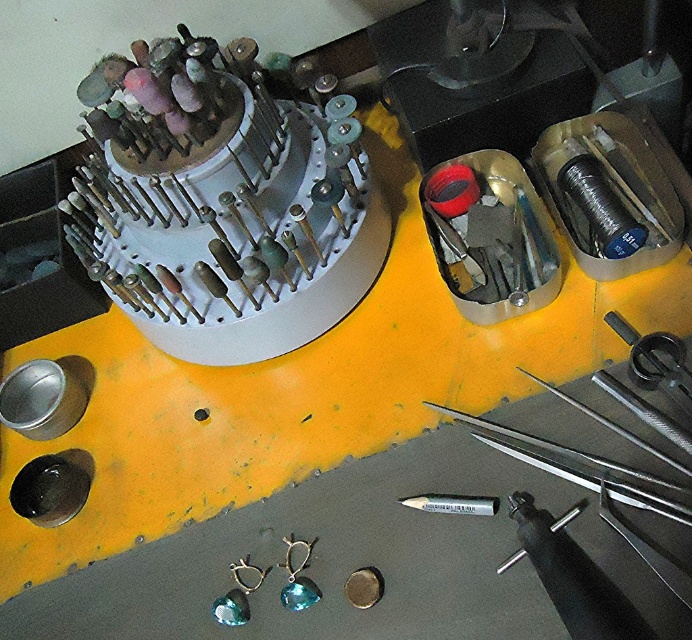
Is white plastic grinding wheel at upper center below silver metallic pen at lower center?

Actually, white plastic grinding wheel at upper center is above silver metallic pen at lower center.

Does point (219, 81) come in front of point (582, 403)?

No, (219, 81) is behind (582, 403).

Locate an element on the screen. white plastic grinding wheel at upper center is located at coordinates (221, 205).